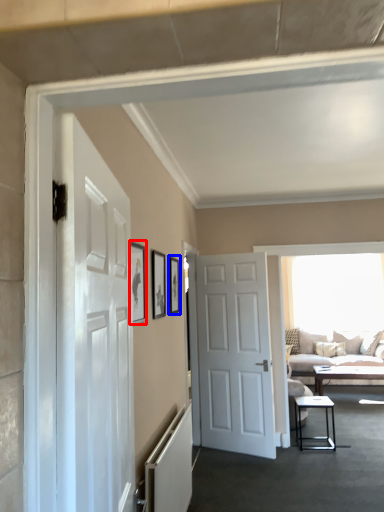
Question: Which object appears farthest to the camera in this image, picture frame (highlighted by a red box) or picture frame (highlighted by a blue box)?

Choices:
 (A) picture frame
 (B) picture frame

Answer: (B)